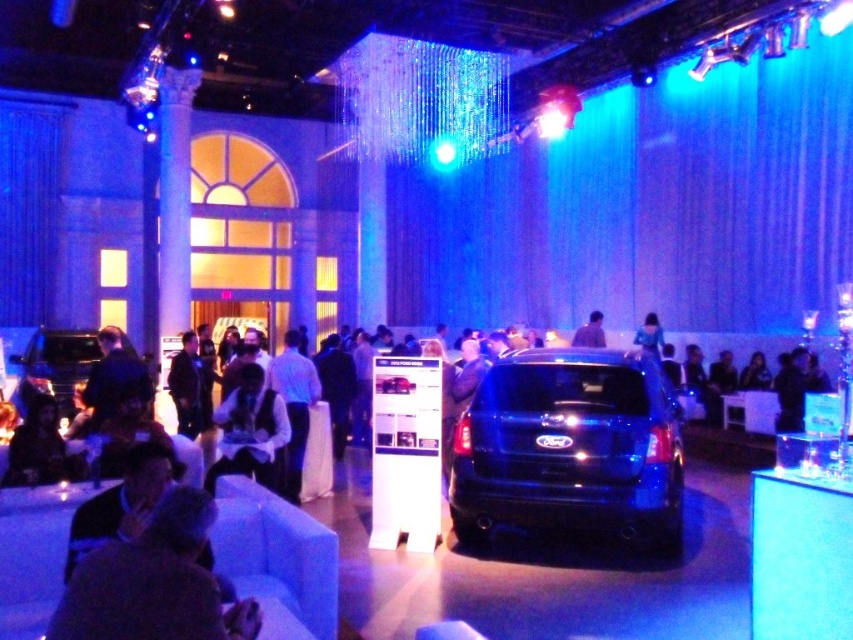
Which is behind, point (659, 472) or point (604, 342)?

Point (604, 342)

Is satin blue suv at center closer to the viewer compared to matte black car at center?

That is True.

The height and width of the screenshot is (640, 853). What are the coordinates of `satin blue suv at center` in the screenshot? It's located at [x=570, y=448].

Is satin blue suv at center above blue fabric shirt at center?

No, satin blue suv at center is not above blue fabric shirt at center.

Does satin blue suv at center have a larger size compared to blue fabric shirt at center?

Indeed, satin blue suv at center has a larger size compared to blue fabric shirt at center.

What do you see at coordinates (570, 448) in the screenshot? I see `satin blue suv at center` at bounding box center [570, 448].

Find the location of `satin blue suv at center`. satin blue suv at center is located at coordinates (570, 448).

Can you confirm if dark brown leather jacket at lower left is positioned to the left of matte black car at center?

Yes, dark brown leather jacket at lower left is to the left of matte black car at center.

Can you confirm if dark brown leather jacket at lower left is thinner than matte black car at center?

In fact, dark brown leather jacket at lower left might be wider than matte black car at center.

Is point (178, 589) positioned in front of point (599, 321)?

Yes.

This screenshot has height=640, width=853. In order to click on dark brown leather jacket at lower left in this screenshot , I will do `click(154, 582)`.